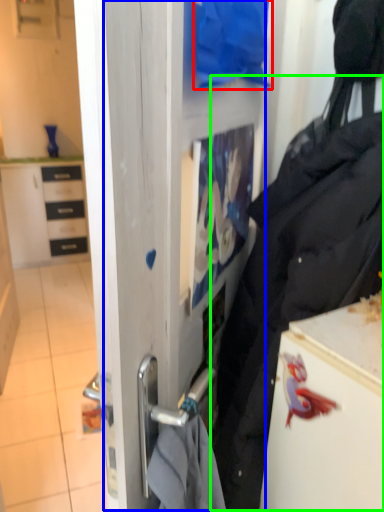
Question: Considering the real-world distances, which object is closest to clothing (highlighted by a red box)? glass door (highlighted by a blue box) or tote bag (highlighted by a green box).

Choices:
 (A) glass door
 (B) tote bag

Answer: (A)